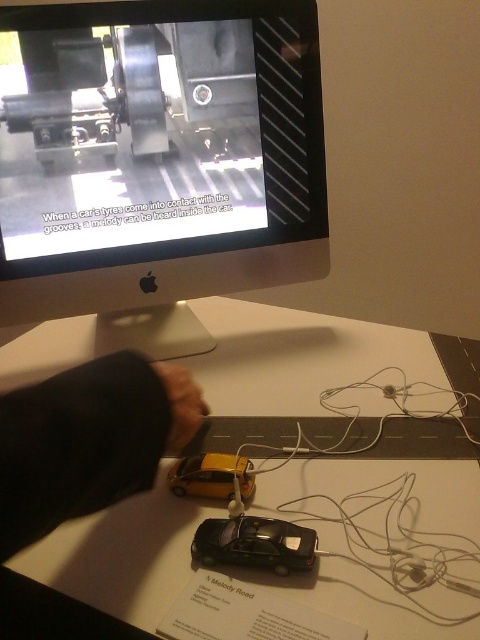
Looking at this image, does satin silver monitor at upper center have a greater width compared to black fabric hand at lower left?

Yes.

Can you confirm if satin silver monitor at upper center is bigger than black fabric hand at lower left?

Indeed, satin silver monitor at upper center has a larger size compared to black fabric hand at lower left.

Between point (269, 48) and point (111, 502), which one is positioned in front?

Positioned in front is point (111, 502).

Where is `satin silver monitor at upper center`? This screenshot has height=640, width=480. satin silver monitor at upper center is located at coordinates (156, 150).

Between point (51, 513) and point (172, 452), which one is positioned in front?

Point (51, 513) is more forward.

How much distance is there between black fabric hand at lower left and brown leather hand at lower center?

5.62 centimeters

Where is `black fabric hand at lower left`? This screenshot has height=640, width=480. black fabric hand at lower left is located at coordinates pos(87,442).

Who is more forward, (296, 102) or (294, 554)?

Positioned in front is point (294, 554).

Can you confirm if satin silver monitor at upper center is positioned to the left of shiny black car at center?

Yes, satin silver monitor at upper center is to the left of shiny black car at center.

Does point (162, 44) come in front of point (247, 515)?

No, (162, 44) is behind (247, 515).

What are the coordinates of `satin silver monitor at upper center` in the screenshot? It's located at (156, 150).